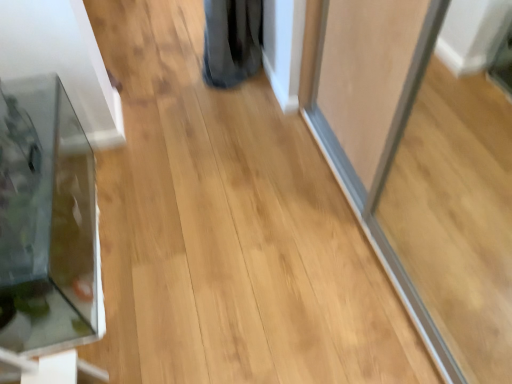
Locate an element on the screen. The width and height of the screenshot is (512, 384). vacant space behind clear glass aquarium at left is located at coordinates click(x=151, y=141).